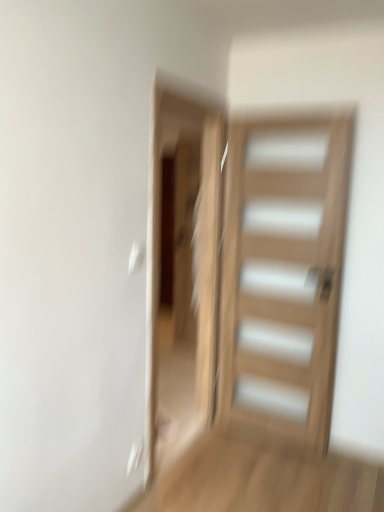
Locate an element on the screen. natural wood door at center is located at coordinates (283, 274).

What do you see at coordinates (283, 274) in the screenshot? This screenshot has width=384, height=512. I see `natural wood door at center` at bounding box center [283, 274].

What do you see at coordinates (182, 271) in the screenshot? The height and width of the screenshot is (512, 384). I see `transparent glass screen door at center` at bounding box center [182, 271].

The height and width of the screenshot is (512, 384). What are the coordinates of `transparent glass screen door at center` in the screenshot? It's located at click(182, 271).

What are the coordinates of `natural wood door at center` in the screenshot? It's located at pyautogui.click(x=283, y=274).

Is natural wood door at center at the left side of transparent glass screen door at center?

Incorrect, natural wood door at center is not on the left side of transparent glass screen door at center.

From the picture: Who is more distant, natural wood door at center or transparent glass screen door at center?

natural wood door at center is behind.

Is point (320, 358) less distant than point (214, 389)?

Yes, it is in front of point (214, 389).

From the image's perspective, who appears lower, natural wood door at center or transparent glass screen door at center?

From the image's view, natural wood door at center is below.

Looking at this image, from a real-world perspective, is natural wood door at center physically located above or below transparent glass screen door at center?

natural wood door at center is situated lower than transparent glass screen door at center in the real world.

Considering the sizes of natural wood door at center and transparent glass screen door at center in the image, is natural wood door at center wider or thinner than transparent glass screen door at center?

In the image, natural wood door at center appears to be more narrow than transparent glass screen door at center.

Is natural wood door at center taller than transparent glass screen door at center?

No.

Is natural wood door at center smaller than transparent glass screen door at center?

Yes, natural wood door at center is smaller than transparent glass screen door at center.

Can we say natural wood door at center lies outside transparent glass screen door at center?

natural wood door at center is positioned outside transparent glass screen door at center.

Is natural wood door at center next to transparent glass screen door at center?

natural wood door at center and transparent glass screen door at center are clearly separated.

Is natural wood door at center looking in the opposite direction of transparent glass screen door at center?

natural wood door at center does not have its back to transparent glass screen door at center.

How many degrees apart are the facing directions of natural wood door at center and transparent glass screen door at center?

There is a 88.6-degree angle between the facing directions of natural wood door at center and transparent glass screen door at center.

The width and height of the screenshot is (384, 512). There is a natural wood door at center. In order to click on screen door above it (from a real-world perspective) in this screenshot , I will do `click(182, 271)`.

Does transparent glass screen door at center appear on the left side of natural wood door at center?

Yes.

In the image, is transparent glass screen door at center positioned in front of or behind natural wood door at center?

Clearly, transparent glass screen door at center is in front of natural wood door at center.

Which is closer to the camera, (201, 274) or (235, 177)?

Point (201, 274) appears to be farther away from the viewer than point (235, 177).

From the image's perspective, which one is positioned lower, transparent glass screen door at center or natural wood door at center?

natural wood door at center, from the image's perspective.

From a real-world perspective, is transparent glass screen door at center positioned above or below natural wood door at center?

From a real-world perspective, transparent glass screen door at center is physically above natural wood door at center.

Looking at their sizes, would you say transparent glass screen door at center is wider or thinner than natural wood door at center?

transparent glass screen door at center is wider than natural wood door at center.

Can you confirm if transparent glass screen door at center is taller than natural wood door at center?

Yes, transparent glass screen door at center is taller than natural wood door at center.

Between transparent glass screen door at center and natural wood door at center, which one has larger size?

transparent glass screen door at center.

Is natural wood door at center completely or partially inside transparent glass screen door at center?

No, natural wood door at center is not inside transparent glass screen door at center.

Are transparent glass screen door at center and natural wood door at center located far from each other?

No, transparent glass screen door at center is not far from natural wood door at center.

Is transparent glass screen door at center positioned with its back to natural wood door at center?

Yes.

How different are the orientations of transparent glass screen door at center and natural wood door at center in degrees?

The angle between the facing direction of transparent glass screen door at center and the facing direction of natural wood door at center is 88.6 degrees.

This screenshot has height=512, width=384. I want to click on screen door that appears above the natural wood door at center (from a real-world perspective), so click(182, 271).

What are the coordinates of `door on the right of transparent glass screen door at center` in the screenshot? It's located at (283, 274).

Where is `door behind the transparent glass screen door at center`? This screenshot has width=384, height=512. door behind the transparent glass screen door at center is located at coordinates (283, 274).